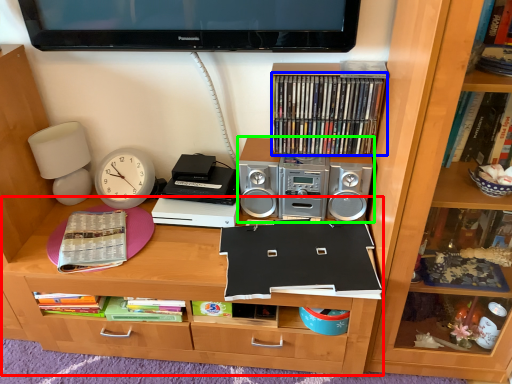
Question: Considering the real-world distances, which object is farthest from desk (highlighted by a red box)? book (highlighted by a blue box) or stereo (highlighted by a green box)?

Choices:
 (A) book
 (B) stereo

Answer: (A)